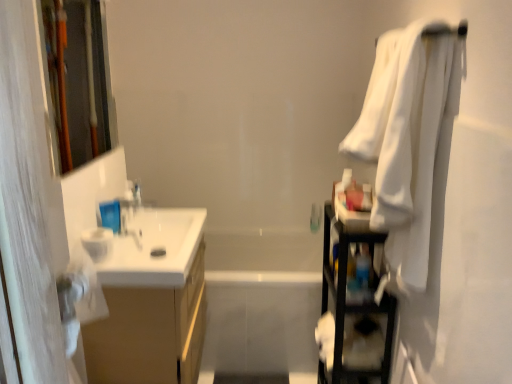
Question: Could you tell me if wooden frame at left is facing white glossy bathtub at center?

Choices:
 (A) yes
 (B) no

Answer: (B)

Question: From the image's perspective, does wooden frame at left appear higher than white glossy bathtub at center?

Choices:
 (A) no
 (B) yes

Answer: (B)

Question: Is wooden frame at left far from white glossy bathtub at center?

Choices:
 (A) yes
 (B) no

Answer: (A)

Question: Is wooden frame at left further to camera compared to white glossy bathtub at center?

Choices:
 (A) yes
 (B) no

Answer: (B)

Question: Does wooden frame at left have a greater width compared to white glossy bathtub at center?

Choices:
 (A) yes
 (B) no

Answer: (B)

Question: From a real-world perspective, is matte wood cabinet at left above or below white glossy bathtub at center?

Choices:
 (A) below
 (B) above

Answer: (B)

Question: Is point [x=81, y=332] positioned closer to the camera than point [x=256, y=336]?

Choices:
 (A) closer
 (B) farther

Answer: (A)

Question: From the image's perspective, is matte wood cabinet at left above or below white glossy bathtub at center?

Choices:
 (A) below
 (B) above

Answer: (A)

Question: Considering the positions of matte wood cabinet at left and white glossy bathtub at center in the image, is matte wood cabinet at left bigger or smaller than white glossy bathtub at center?

Choices:
 (A) big
 (B) small

Answer: (B)

Question: From the image's perspective, is black plastic shelf at right above or below clear plastic bottle at upper left?

Choices:
 (A) above
 (B) below

Answer: (B)

Question: In terms of width, does black plastic shelf at right look wider or thinner when compared to clear plastic bottle at upper left?

Choices:
 (A) wide
 (B) thin

Answer: (A)

Question: Which is correct: black plastic shelf at right is inside clear plastic bottle at upper left, or outside of it?

Choices:
 (A) inside
 (B) outside

Answer: (B)

Question: Considering their positions, is black plastic shelf at right located in front of or behind clear plastic bottle at upper left?

Choices:
 (A) behind
 (B) front

Answer: (B)

Question: Considering their positions, is white soft towel at right located in front of or behind white glossy sink at left?

Choices:
 (A) front
 (B) behind

Answer: (A)

Question: In terms of size, does white soft towel at right appear bigger or smaller than white glossy sink at left?

Choices:
 (A) small
 (B) big

Answer: (B)